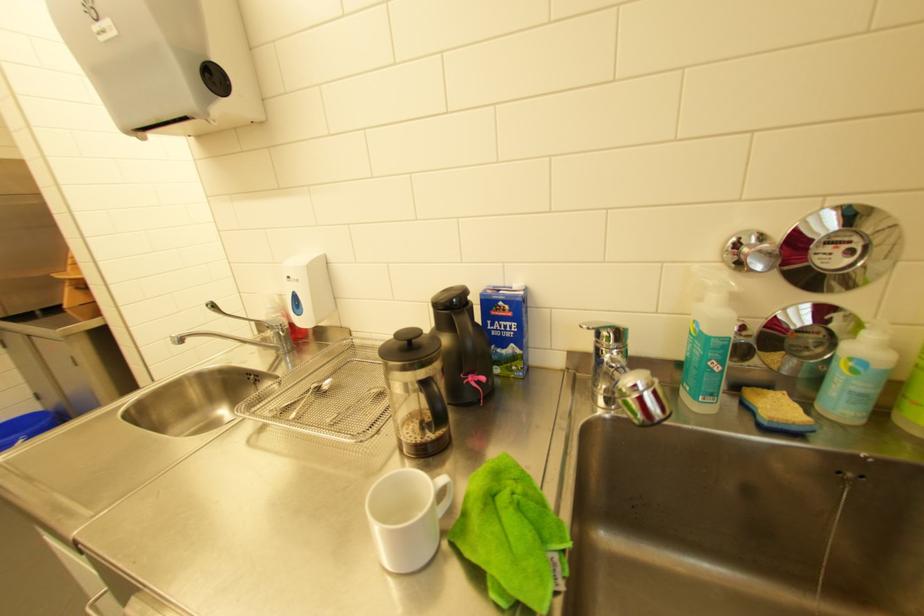
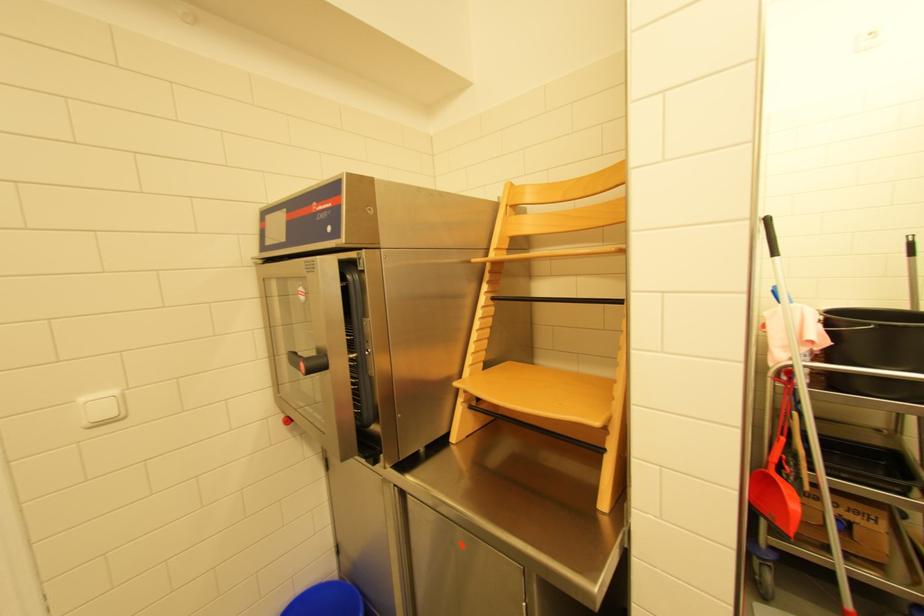
What movement of the cameraman would produce the second image?

The cameraman walked toward left, forward.